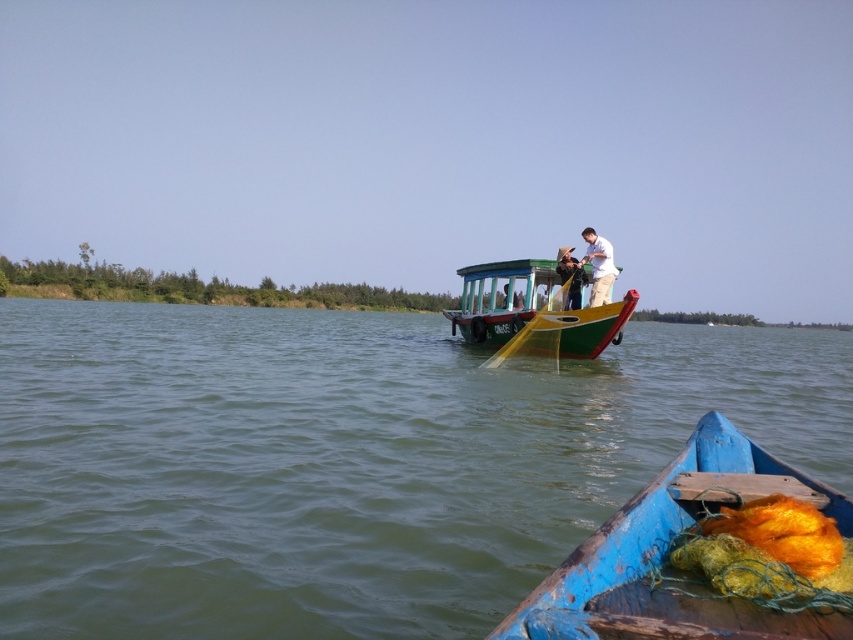
Can you confirm if blue wooden boat at lower right is positioned above green painted wood boat at center?

Actually, blue wooden boat at lower right is below green painted wood boat at center.

The height and width of the screenshot is (640, 853). Identify the location of blue wooden boat at lower right. (666, 557).

What do you see at coordinates (666, 557) in the screenshot? I see `blue wooden boat at lower right` at bounding box center [666, 557].

Find the location of a particular element. This screenshot has height=640, width=853. blue wooden boat at lower right is located at coordinates (666, 557).

Who is shorter, blue wooden boat at lower right or white matte shirt at upper right?

Standing shorter between the two is blue wooden boat at lower right.

Looking at this image, is blue wooden boat at lower right further to camera compared to white matte shirt at upper right?

That is False.

The width and height of the screenshot is (853, 640). What are the coordinates of `blue wooden boat at lower right` in the screenshot? It's located at 666,557.

You are a GUI agent. You are given a task and a screenshot of the screen. Output one action in this format:
    pyautogui.click(x=<x>, y=<y>)
    Task: Click on the blue wooden boat at lower right
    The width and height of the screenshot is (853, 640).
    Given the screenshot: What is the action you would take?
    pyautogui.click(x=666, y=557)

Looking at this image, can you confirm if green wooden boat at center is positioned to the left of green painted wood boat at center?

No, green wooden boat at center is not to the left of green painted wood boat at center.

Is point (94, 602) positioned before point (480, 264)?

Yes, it is.

What do you see at coordinates (346, 461) in the screenshot?
I see `green wooden boat at center` at bounding box center [346, 461].

Locate an element on the screen. green wooden boat at center is located at coordinates (346, 461).